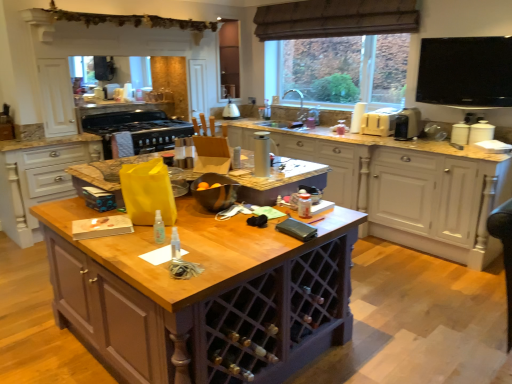
Question: From a real-world perspective, is wooden cabinet at center, the third cabinetry from the right, physically located above or below brown textured curtain at upper center?

Choices:
 (A) above
 (B) below

Answer: (B)

Question: Considering the positions of point (71, 163) and point (334, 36), is point (71, 163) closer or farther from the camera than point (334, 36)?

Choices:
 (A) closer
 (B) farther

Answer: (A)

Question: Which object is the closest to the white wood cabinets at center, the 1th cabinetry positioned from the right?

Choices:
 (A) brown textured curtain at upper center
 (B) metallic silver bowl at center, which is the 5th appliance in right-to-left order
 (C) silver metallic thermos at center, the 6th appliance from the back
 (D) black matte stove at upper left, which is counted as the 7th appliance, starting from the right
 (E) white matte canister at right, which is the fifth appliance from back to front

Answer: (E)

Question: Estimate the real-world distances between objects in this image. Which object is farther from the wooden cabinet at center, which ranks as the first cabinetry in left-to-right order?

Choices:
 (A) black matte stove at upper left, the 6th appliance from the front
 (B) beige plastic toaster at upper right, which is counted as the 5th appliance, starting from the front
 (C) silver metallic thermos at center, the fourth appliance when ordered from right to left
 (D) brown textured curtain at upper center
 (E) metallic silver kettle at center, acting as the 2th appliance starting from the left

Answer: (B)